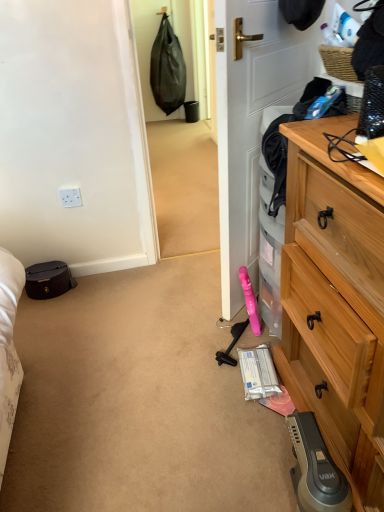
The height and width of the screenshot is (512, 384). I want to click on free space in front of matte black suitcase at left, so click(44, 314).